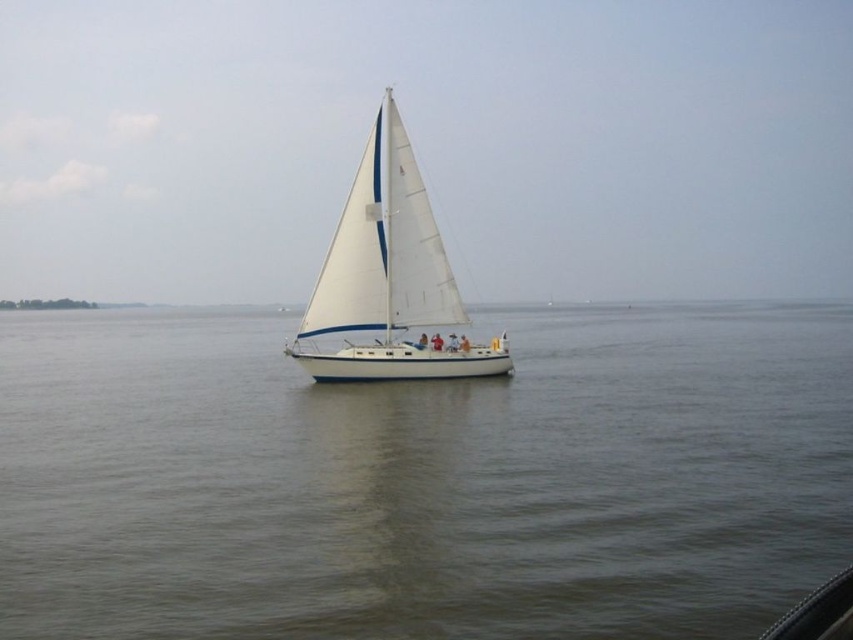
You are a photographer trying to capture the sailboat scene. You have two points marked on your camera screen at coordinates point (409, 625) and point (430, 298). Which point is closer to your camera lens?

Point (409, 625) is closer to the camera than point (430, 298).

You are planning to take a photo of the white matte sailboat at center and the gray water at center. Which object should you focus on first if you want to capture both in a single frame without moving the camera?

The gray water at center has a larger width than the white matte sailboat at center, so you should focus on the white matte sailboat at center first to ensure it fits within the frame while still capturing the broader area of the gray water at center.